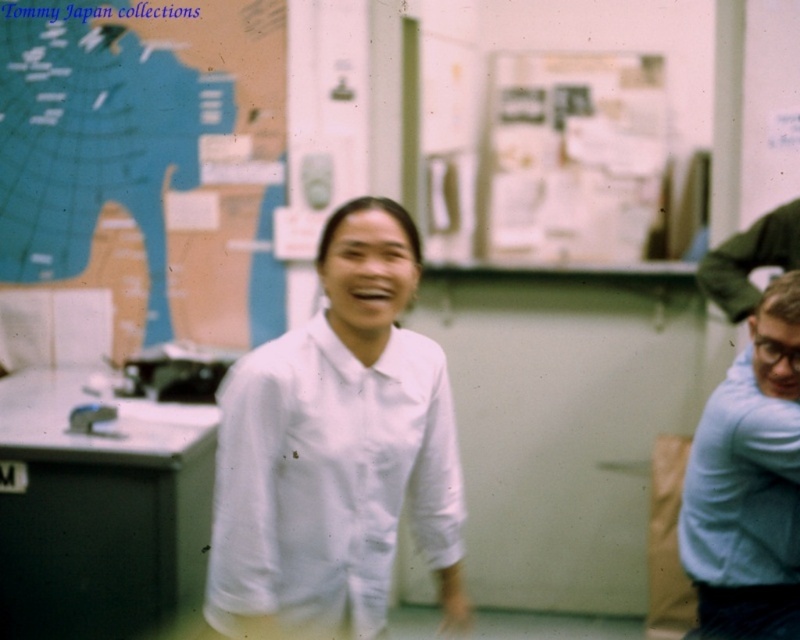
Is point (222, 570) closer to camera compared to point (574, 115)?

That is True.

Between point (366, 433) and point (620, 240), which one is positioned in front?

Positioned in front is point (366, 433).

At what (x,y) coordinates should I click in order to perform the action: click on white smooth shirt at center. Please return your answer as a coordinate pair (x, y). The height and width of the screenshot is (640, 800). Looking at the image, I should click on (337, 445).

Is white smooth shirt at center to the right of light blue sweater at right from the viewer's perspective?

No, white smooth shirt at center is not to the right of light blue sweater at right.

Is point (256, 349) in front of point (766, 376)?

No, (256, 349) is further to viewer.

You are a GUI agent. You are given a task and a screenshot of the screen. Output one action in this format:
    pyautogui.click(x=<x>, y=<y>)
    Task: Click on the white smooth shirt at center
    The height and width of the screenshot is (640, 800).
    Given the screenshot: What is the action you would take?
    pyautogui.click(x=337, y=445)

Which is more to the right, white paperboard at upper center or light blue sweater at right?

Positioned to the right is light blue sweater at right.

Is point (584, 129) positioned after point (776, 586)?

That is True.

Between point (633, 209) and point (705, 410), which one is positioned behind?

The point (633, 209) is more distant.

Identify the location of white paperboard at upper center. (574, 156).